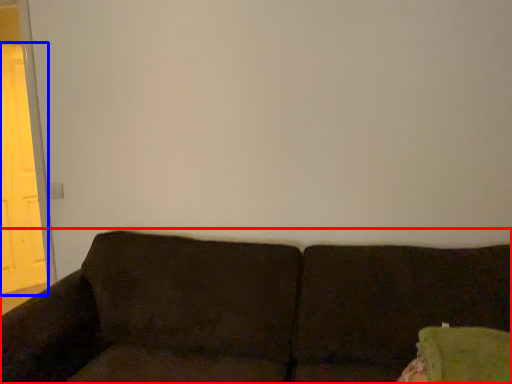
Question: Which object is closer to the camera taking this photo, studio couch (highlighted by a red box) or screen door (highlighted by a blue box)?

Choices:
 (A) studio couch
 (B) screen door

Answer: (A)